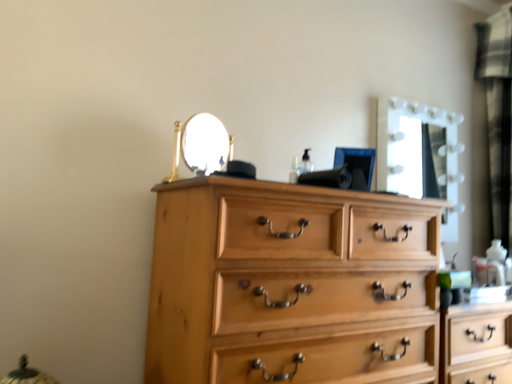
Question: Should I look upward or downward to see natural wood chest of drawers at center?

Choices:
 (A) up
 (B) down

Answer: (B)

Question: Does natural wood chest of drawers at center turn towards white glossy mirror at upper right?

Choices:
 (A) no
 (B) yes

Answer: (A)

Question: Is natural wood chest of drawers at center far from white glossy mirror at upper right?

Choices:
 (A) yes
 (B) no

Answer: (B)

Question: Does natural wood chest of drawers at center have a lesser height compared to white glossy mirror at upper right?

Choices:
 (A) yes
 (B) no

Answer: (B)

Question: Is natural wood chest of drawers at center positioned in front of white glossy mirror at upper right?

Choices:
 (A) yes
 (B) no

Answer: (A)

Question: Can you confirm if natural wood chest of drawers at center is taller than white glossy mirror at upper right?

Choices:
 (A) yes
 (B) no

Answer: (A)

Question: Does natural wood chest of drawers at center have a larger size compared to white glossy mirror at upper right?

Choices:
 (A) no
 (B) yes

Answer: (B)

Question: Does white glossy mirror at upper right have a greater width compared to natural wood chest of drawers at center?

Choices:
 (A) yes
 (B) no

Answer: (B)

Question: Considering the relative positions of white glossy mirror at upper right and natural wood chest of drawers at center in the image provided, is white glossy mirror at upper right to the right of natural wood chest of drawers at center from the viewer's perspective?

Choices:
 (A) no
 (B) yes

Answer: (B)

Question: Is white glossy mirror at upper right closer to camera compared to natural wood chest of drawers at center?

Choices:
 (A) yes
 (B) no

Answer: (B)

Question: Considering the relative sizes of white glossy mirror at upper right and natural wood chest of drawers at center in the image provided, is white glossy mirror at upper right thinner than natural wood chest of drawers at center?

Choices:
 (A) yes
 (B) no

Answer: (A)

Question: From the image's perspective, does white glossy mirror at upper right appear higher than natural wood chest of drawers at center?

Choices:
 (A) yes
 (B) no

Answer: (A)

Question: Considering the relative sizes of white glossy mirror at upper right and natural wood chest of drawers at center in the image provided, is white glossy mirror at upper right shorter than natural wood chest of drawers at center?

Choices:
 (A) no
 (B) yes

Answer: (B)

Question: Does natural wood chest of drawers at center have a smaller size compared to black textured curtain at right?

Choices:
 (A) no
 (B) yes

Answer: (A)